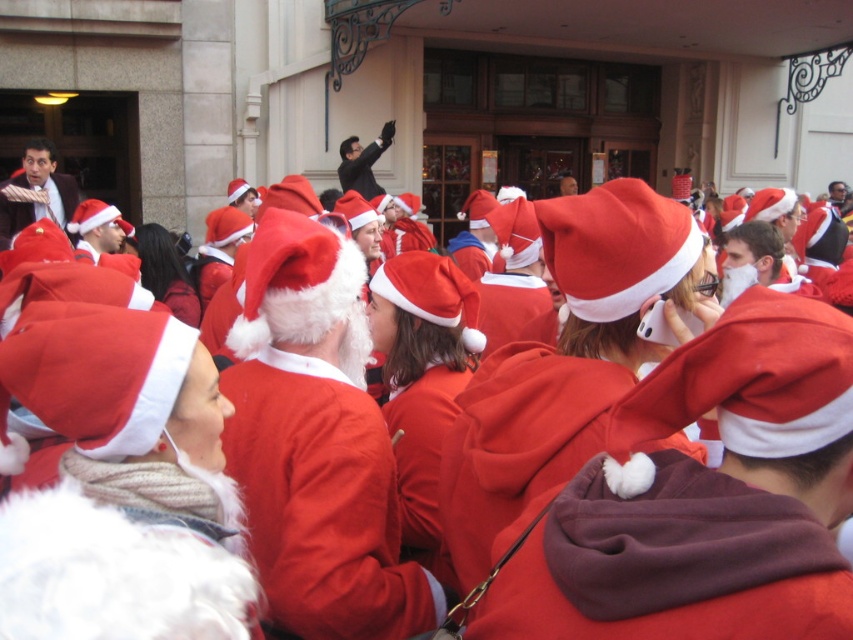
Question: Is matte black suit at upper left thinner than smooth black suit at upper center?

Choices:
 (A) no
 (B) yes

Answer: (B)

Question: Which object is closer to the camera taking this photo?

Choices:
 (A) matte black suit at upper left
 (B) smooth black suit at upper center

Answer: (A)

Question: Does matte black suit at upper left have a smaller size compared to smooth black suit at upper center?

Choices:
 (A) yes
 (B) no

Answer: (B)

Question: Can you confirm if matte black suit at upper left is wider than smooth black suit at upper center?

Choices:
 (A) no
 (B) yes

Answer: (A)